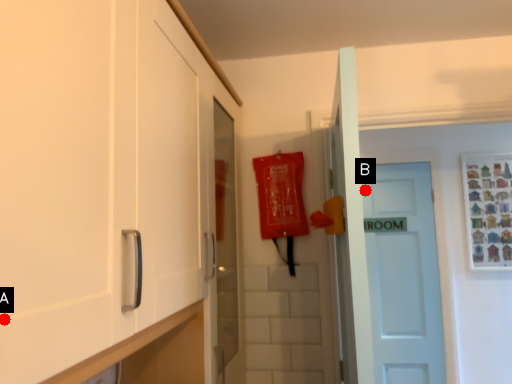
Question: Two points are circled on the image, labeled by A and B beside each circle. Which of the following is the closest to the observer?

Choices:
 (A) A is closer
 (B) B is closer

Answer: (A)